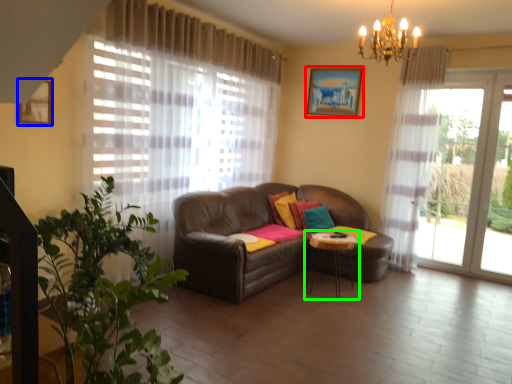
Question: Which object is positioned closest to picture frame (highlighted by a red box)? Select from picture frame (highlighted by a blue box) and table (highlighted by a green box).

Choices:
 (A) picture frame
 (B) table

Answer: (B)